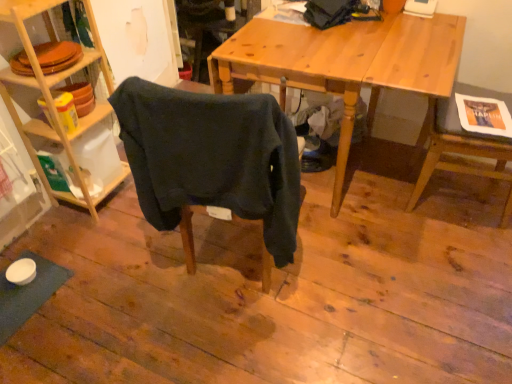
Question: From the image's perspective, is wooden desk at center on top of wooden chair at right, the first chair positioned from the right?

Choices:
 (A) yes
 (B) no

Answer: (A)

Question: Considering the relative sizes of wooden desk at center and wooden chair at right, placed as the second chair when sorted from left to right, in the image provided, is wooden desk at center thinner than wooden chair at right, placed as the second chair when sorted from left to right,?

Choices:
 (A) no
 (B) yes

Answer: (A)

Question: Is wooden desk at center bigger than wooden chair at right, placed as the second chair when sorted from left to right?

Choices:
 (A) yes
 (B) no

Answer: (A)

Question: Are wooden desk at center and wooden chair at right, the first chair positioned from the right, making contact?

Choices:
 (A) yes
 (B) no

Answer: (B)

Question: From a real-world perspective, is wooden desk at center over wooden chair at right, placed as the second chair when sorted from left to right?

Choices:
 (A) yes
 (B) no

Answer: (B)

Question: Considering the positions of point (288, 66) and point (0, 8), is point (288, 66) closer or farther from the camera than point (0, 8)?

Choices:
 (A) farther
 (B) closer

Answer: (A)

Question: In terms of height, does wooden desk at center look taller or shorter compared to woodenshelves at left?

Choices:
 (A) short
 (B) tall

Answer: (A)

Question: From a real-world perspective, is wooden desk at center positioned above or below woodenshelves at left?

Choices:
 (A) below
 (B) above

Answer: (A)

Question: Relative to woodenshelves at left, is wooden desk at center in front or behind?

Choices:
 (A) front
 (B) behind

Answer: (B)

Question: Based on their positions, is dark blue fabric chair at center, the 2th chair positioned from the right, located to the left or right of woodenshelves at left?

Choices:
 (A) left
 (B) right

Answer: (B)

Question: From the image's perspective, is dark blue fabric chair at center, marked as the first chair in a left-to-right arrangement, above or below woodenshelves at left?

Choices:
 (A) below
 (B) above

Answer: (A)

Question: In terms of size, does dark blue fabric chair at center, the 2th chair positioned from the right, appear bigger or smaller than woodenshelves at left?

Choices:
 (A) small
 (B) big

Answer: (A)

Question: In terms of width, does dark blue fabric chair at center, the 2th chair positioned from the right, look wider or thinner when compared to woodenshelves at left?

Choices:
 (A) thin
 (B) wide

Answer: (A)

Question: From the image's perspective, is wooden chair at right, placed as the second chair when sorted from left to right, above or below woodenshelves at left?

Choices:
 (A) above
 (B) below

Answer: (B)

Question: Relative to woodenshelves at left, is wooden chair at right, the first chair positioned from the right, in front or behind?

Choices:
 (A) behind
 (B) front

Answer: (B)